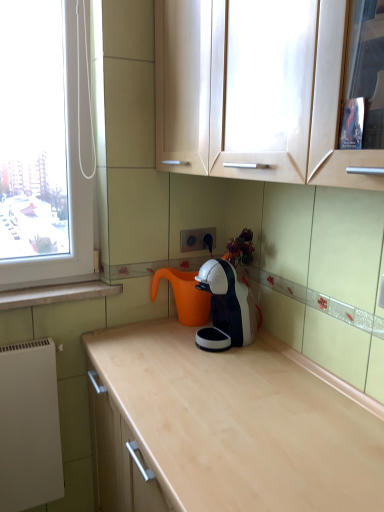
Question: Can you confirm if white plastic electric outlet at center is bigger than white glossy coffee machine at center?

Choices:
 (A) no
 (B) yes

Answer: (A)

Question: Is white plastic electric outlet at center in front of white glossy coffee machine at center?

Choices:
 (A) no
 (B) yes

Answer: (A)

Question: Does white plastic electric outlet at center contain white glossy coffee machine at center?

Choices:
 (A) yes
 (B) no

Answer: (B)

Question: Is white plastic electric outlet at center next to white glossy coffee machine at center and touching it?

Choices:
 (A) yes
 (B) no

Answer: (B)

Question: From the image's perspective, is white plastic electric outlet at center under white glossy coffee machine at center?

Choices:
 (A) yes
 (B) no

Answer: (B)

Question: Is point (28, 402) positioned closer to the camera than point (200, 286)?

Choices:
 (A) farther
 (B) closer

Answer: (B)

Question: Would you say white matte radiator at lower left is inside or outside white glossy coffee machine at center?

Choices:
 (A) outside
 (B) inside

Answer: (A)

Question: In terms of size, does white matte radiator at lower left appear bigger or smaller than white glossy coffee machine at center?

Choices:
 (A) small
 (B) big

Answer: (B)

Question: In terms of height, does white matte radiator at lower left look taller or shorter compared to white glossy coffee machine at center?

Choices:
 (A) short
 (B) tall

Answer: (B)

Question: From a real-world perspective, is white plastic electric outlet at center positioned above or below white matte radiator at lower left?

Choices:
 (A) above
 (B) below

Answer: (A)

Question: From the image's perspective, is white plastic electric outlet at center positioned above or below white matte radiator at lower left?

Choices:
 (A) below
 (B) above

Answer: (B)

Question: Considering the positions of white plastic electric outlet at center and white matte radiator at lower left in the image, is white plastic electric outlet at center bigger or smaller than white matte radiator at lower left?

Choices:
 (A) big
 (B) small

Answer: (B)

Question: Is point (187, 239) closer or farther from the camera than point (31, 495)?

Choices:
 (A) closer
 (B) farther

Answer: (B)

Question: From a real-world perspective, is white matte radiator at lower left positioned above or below matte wood cabinets at upper center?

Choices:
 (A) below
 (B) above

Answer: (A)

Question: Does point (44, 387) appear closer or farther from the camera than point (180, 97)?

Choices:
 (A) closer
 (B) farther

Answer: (B)